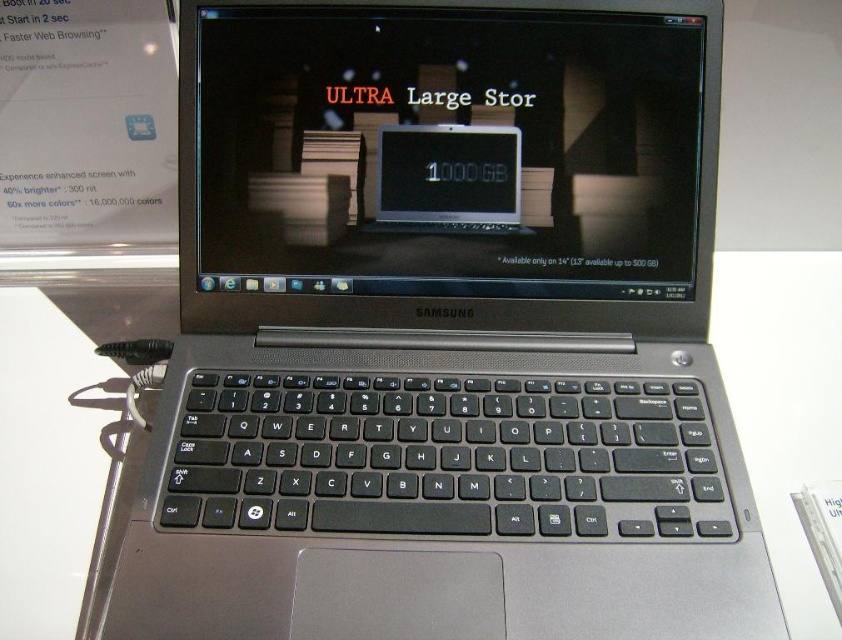
You are setting up a display for a tech event. You have a satin black laptop at center and a black glossy screen at center. The distance between them is crucial for the setup. Can a 3 inch long cable connect both devices without needing to be extended?

The distance between the satin black laptop at center and the black glossy screen at center is 2.94 inches. A 3 inch long cable can connect both devices without needing to be extended since it is slightly longer than the distance required.

You are a photographer taking a closeup shot of the laptop screen. You notice two points marked in the image at coordinates point (x=281, y=244) and point (x=497, y=125). Which point should you focus on to ensure the closer one is sharp in your photo?

You should focus on point (x=281, y=244) because it is closer to the camera than point (x=497, y=125).